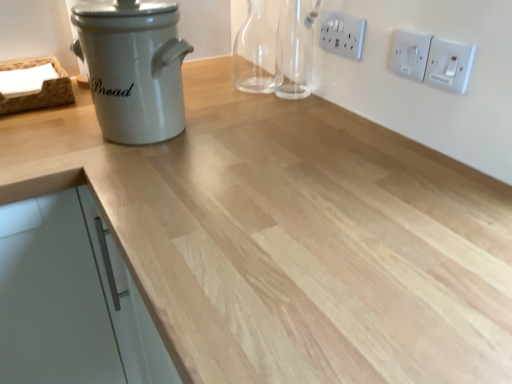
Identify the location of vacant space in front of wooden tray at left. Image resolution: width=512 pixels, height=384 pixels. (32, 125).